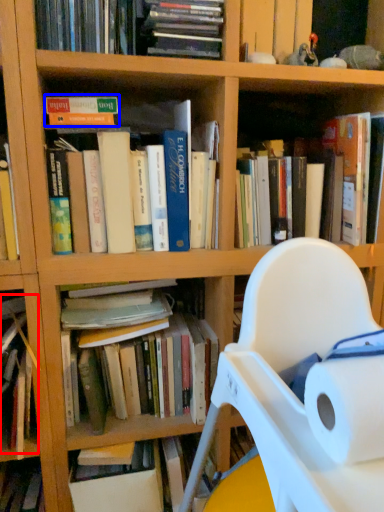
Question: Among these objects, which one is farthest to the camera, book (highlighted by a red box) or book (highlighted by a blue box)?

Choices:
 (A) book
 (B) book

Answer: (A)